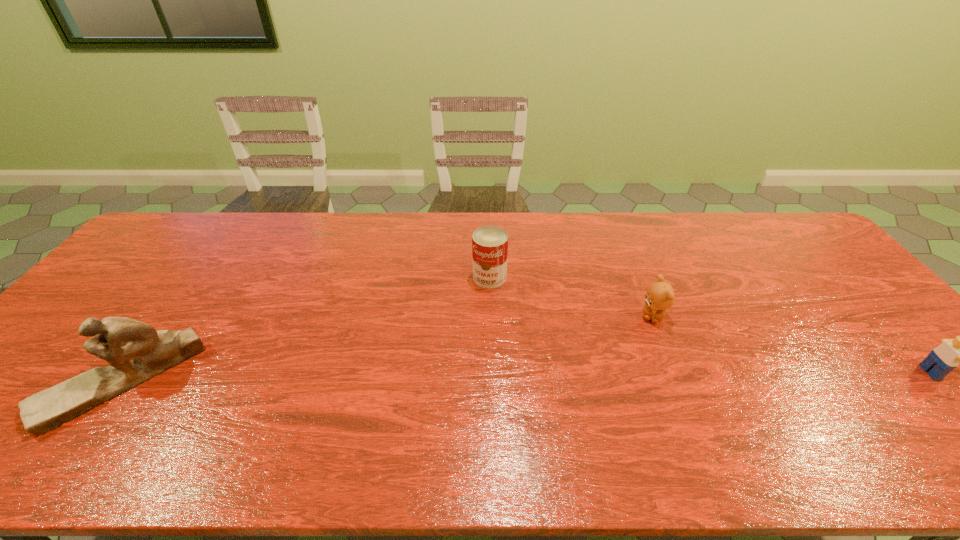
Find the location of a particular element. Image resolution: width=960 pixels, height=540 pixels. vacant space on the desktop that is between the figurine and the rightmost object and is positioned on the front label of the second tallest object is located at coordinates (424, 377).

I want to click on free space on the desktop that is between the figurine and the Lego and is positioned on the face of the third object from left to right, so (621, 375).